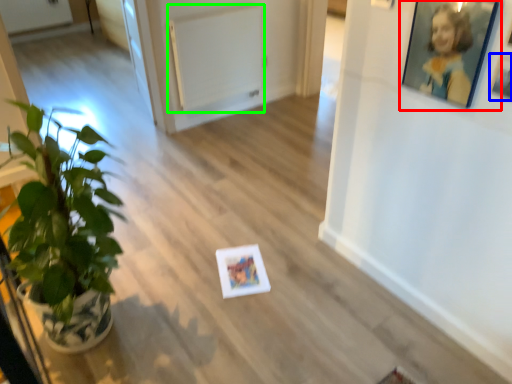
Question: Which object is positioned closest to picture frame (highlighted by a red box)? Select from picture frame (highlighted by a blue box) and radiator (highlighted by a green box).

Choices:
 (A) picture frame
 (B) radiator

Answer: (A)